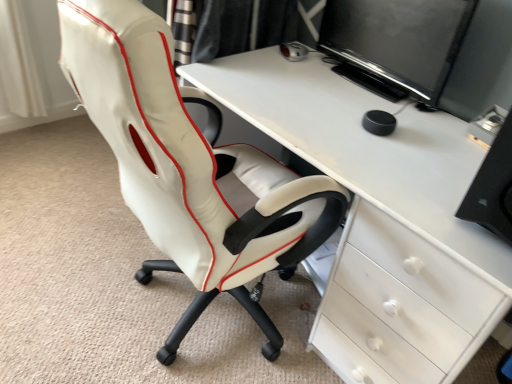
Identify the location of vacant space to the left of black glossy monitor at upper right. (296, 77).